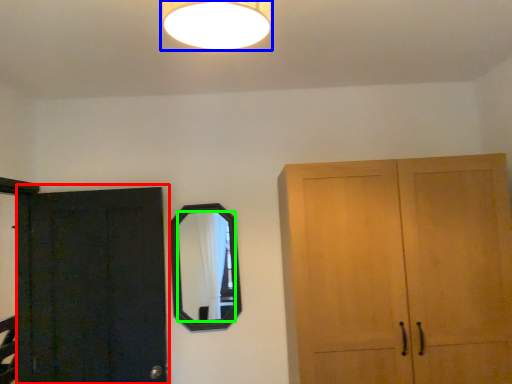
Question: Based on their relative distances, which object is farther from door (highlighted by a red box)? Choose from lamp (highlighted by a blue box) and mirror (highlighted by a green box).

Choices:
 (A) lamp
 (B) mirror

Answer: (A)